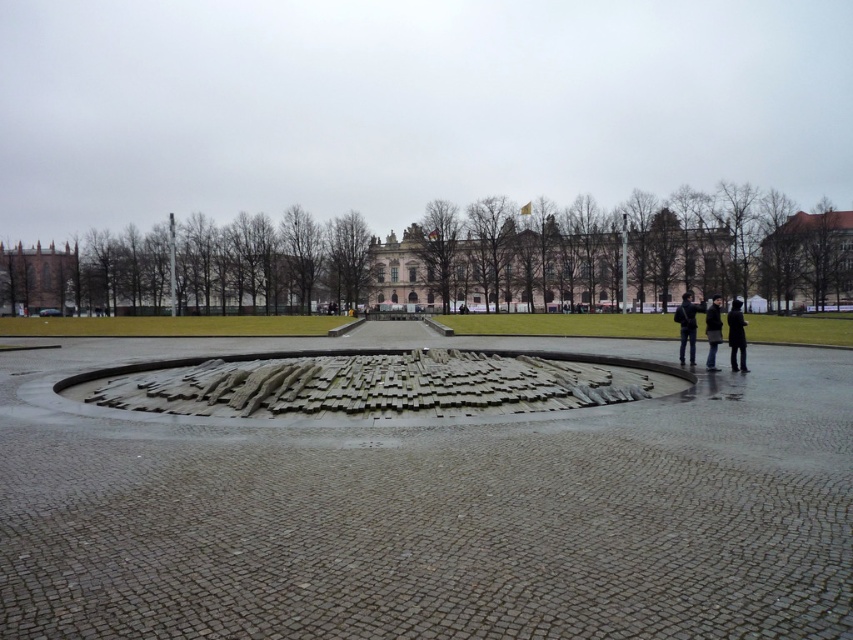
Question: Among these objects, which one is nearest to the camera?

Choices:
 (A) dark gray jacket at right
 (B) black matte jacket at right
 (C) pink stone palace at center
 (D) dark gray coat at center

Answer: (B)

Question: In this image, where is pink stone palace at center located relative to black matte jacket at right?

Choices:
 (A) left
 (B) right

Answer: (B)

Question: Based on their relative distances, which object is farther from the dark gray coat at center?

Choices:
 (A) dark gray jacket at right
 (B) dark gray jacket at center
 (C) brown brick building at left
 (D) black matte jacket at right

Answer: (C)

Question: Among these objects, which one is nearest to the camera?

Choices:
 (A) pink stone palace at center
 (B) dark gray jacket at center
 (C) brown stone building at upper right
 (D) dark gray coat at center

Answer: (D)

Question: Can you confirm if pink stone palace at center is positioned to the left of black matte jacket at right?

Choices:
 (A) no
 (B) yes

Answer: (A)

Question: Is pink stone palace at center to the right of brown stone building at upper right from the viewer's perspective?

Choices:
 (A) no
 (B) yes

Answer: (A)